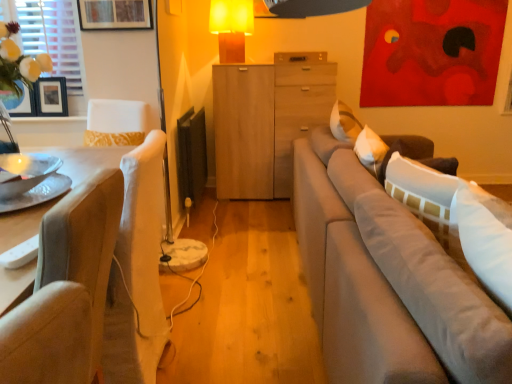
Question: From a real-world perspective, is light wood cabinet at center positioned above or below white fabric window screen at upper left?

Choices:
 (A) below
 (B) above

Answer: (A)

Question: Is light wood cabinet at center inside or outside of white fabric window screen at upper left?

Choices:
 (A) outside
 (B) inside

Answer: (A)

Question: Considering the real-world distances, which object is farthest from the white fabric window screen at upper left?

Choices:
 (A) wooden picture frame at upper left, which appears as the second picture frame when viewed from the back
 (B) matte orange lampshade at upper center
 (C) matte glass vase at left
 (D) textured beige chair at left
 (E) black matte picture frame at left, the first picture frame when ordered from back to front

Answer: (D)

Question: Which object is the closest to the black matte picture frame at left, the first picture frame when ordered from back to front?

Choices:
 (A) light wood cabinet at center
 (B) white fabric window screen at upper left
 (C) light gray fabric couch at right
 (D) matte glass vase at left
 (E) matte orange lampshade at upper center

Answer: (D)